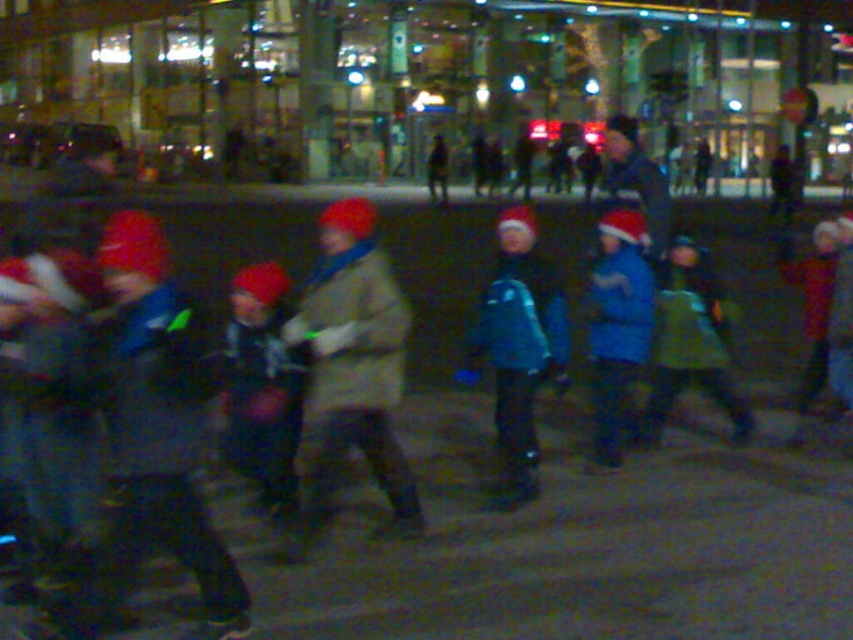
You are organizing a group photo and need to arrange two jackets on a mannequin stand. The camouflage fabric jacket at center and the blue matte jacket at center must be placed side by side. Which jacket should you place on the left side to ensure they fit within a 1.2 meter wide stand?

The blue matte jacket at center should be placed on the left side because the camouflage fabric jacket at center is wider. This arrangement allows both jackets to fit within the 1.2 meter wide stand since the narrower blue matte jacket at center occupies less space on one side.

You are organizing a charity event and need to determine which jacket to use for a photo shoot. Given the camouflage fabric jacket at center and the teal fabric jacket at center, which one would be more visible in the blurry image?

The camouflage fabric jacket at center would be more visible in the blurry image because it has a larger size compared to the teal fabric jacket at center.